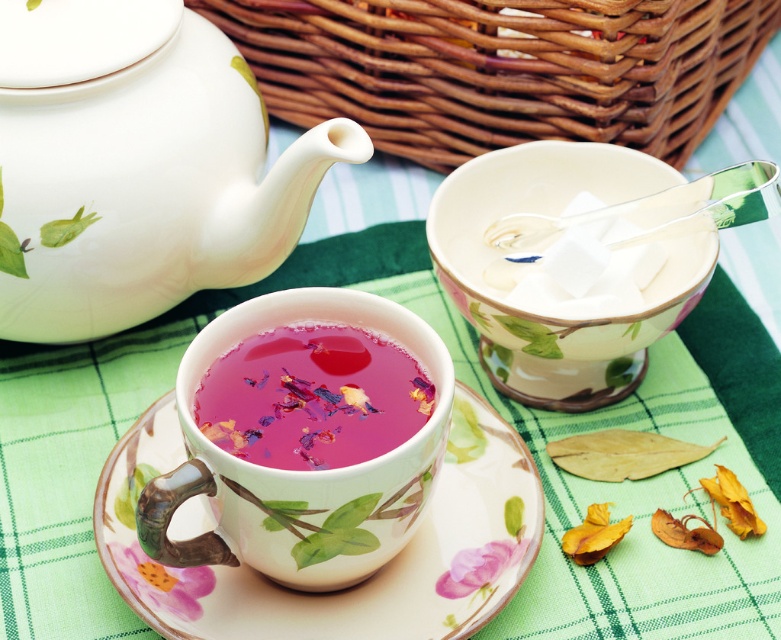
Question: Which point is farther to the camera?

Choices:
 (A) pink floral tea at center
 (B) white glossy teapot at upper left
 (C) matte porcelain teacup at center
 (D) porcelain saucer at center

Answer: (B)

Question: Which point appears closest to the camera in this image?

Choices:
 (A) (358, 561)
 (B) (416, 531)

Answer: (A)

Question: Is matte porcelain teacup at center further to camera compared to pink floral tea at center?

Choices:
 (A) yes
 (B) no

Answer: (B)

Question: Which of the following is the farthest from the observer?

Choices:
 (A) (284, 552)
 (B) (482, 118)

Answer: (B)

Question: Where is brown woven basket at upper center located in relation to matte porcelain teacup at center in the image?

Choices:
 (A) left
 (B) right

Answer: (B)

Question: Is porcelain saucer at center smaller than matte porcelain teacup at center?

Choices:
 (A) no
 (B) yes

Answer: (A)